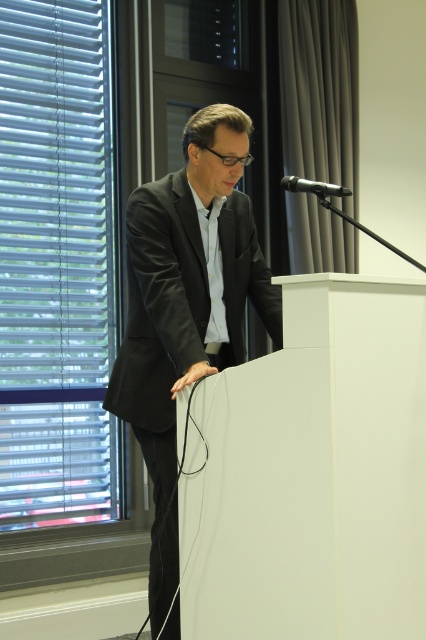
Question: Which object is closer to the camera taking this photo?

Choices:
 (A) black metallic microphone at upper center
 (B) matte black suit at center

Answer: (A)

Question: Can you confirm if matte black suit at center is positioned below black metallic microphone at upper center?

Choices:
 (A) yes
 (B) no

Answer: (A)

Question: Which point is closer to the camera taking this photo?

Choices:
 (A) (235, 196)
 (B) (284, 182)

Answer: (B)

Question: Among these points, which one is nearest to the camera?

Choices:
 (A) (247, 141)
 (B) (348, 188)

Answer: (A)

Question: Is matte black suit at center behind black metallic microphone at upper center?

Choices:
 (A) no
 (B) yes

Answer: (B)

Question: Is matte black suit at center closer to camera compared to black metallic microphone at upper center?

Choices:
 (A) yes
 (B) no

Answer: (B)